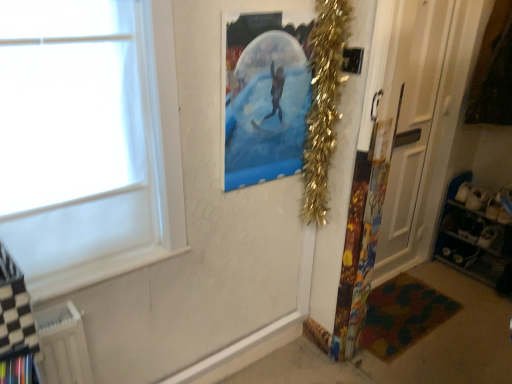
Where is `free space in front of metallic blue shelves at lower right`? The height and width of the screenshot is (384, 512). free space in front of metallic blue shelves at lower right is located at coordinates (479, 305).